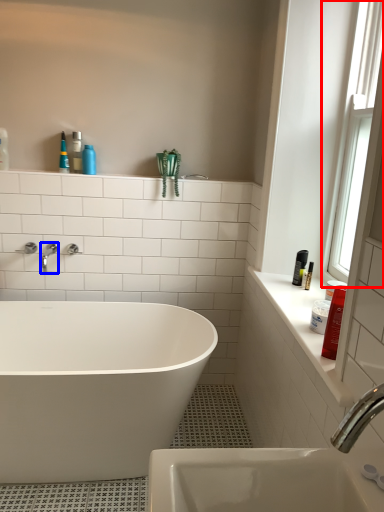
Question: Among these objects, which one is nearest to the camera, window (highlighted by a red box) or tap (highlighted by a blue box)?

Choices:
 (A) window
 (B) tap

Answer: (A)